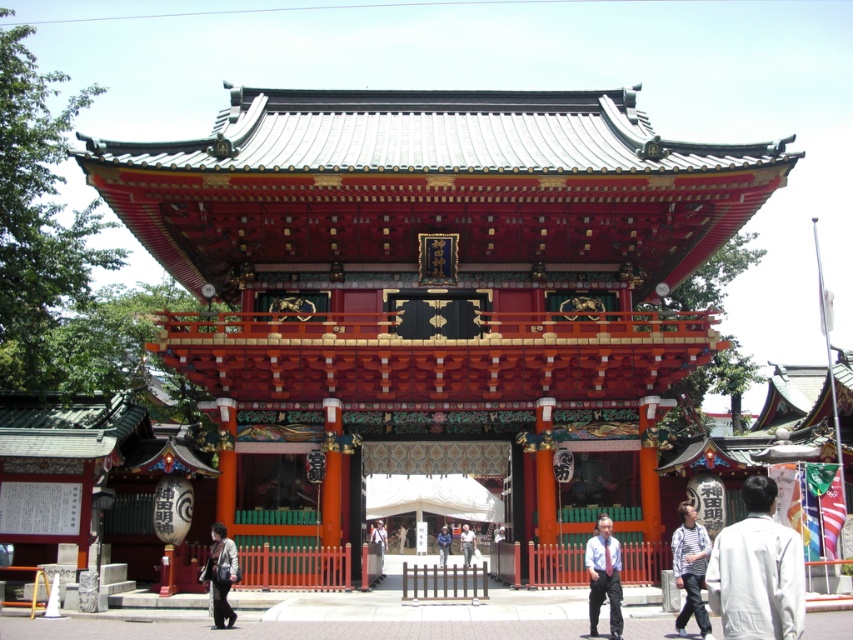
Question: Which point is farther to the camera?

Choices:
 (A) (654, 385)
 (B) (462, 534)

Answer: (B)

Question: Based on their relative distances, which object is nearer to the light blue denim jacket at center?

Choices:
 (A) light gray fabric shirt at center
 (B) shiny lacquered shrine gate at center
 (C) white matte jacket at lower right
 (D) matte black jacket at lower left

Answer: (A)

Question: Is white matte jacket at lower right closer to the viewer compared to light blue denim jacket at center?

Choices:
 (A) yes
 (B) no

Answer: (A)

Question: Which of the following is the closest to the observer?

Choices:
 (A) (728, 620)
 (B) (595, 572)

Answer: (A)

Question: Where is shiny lacquered shrine gate at center located in relation to blue shirt at center in the image?

Choices:
 (A) left
 (B) right

Answer: (A)

Question: Can you confirm if shiny lacquered shrine gate at center is positioned below white shirt at center?

Choices:
 (A) yes
 (B) no

Answer: (B)